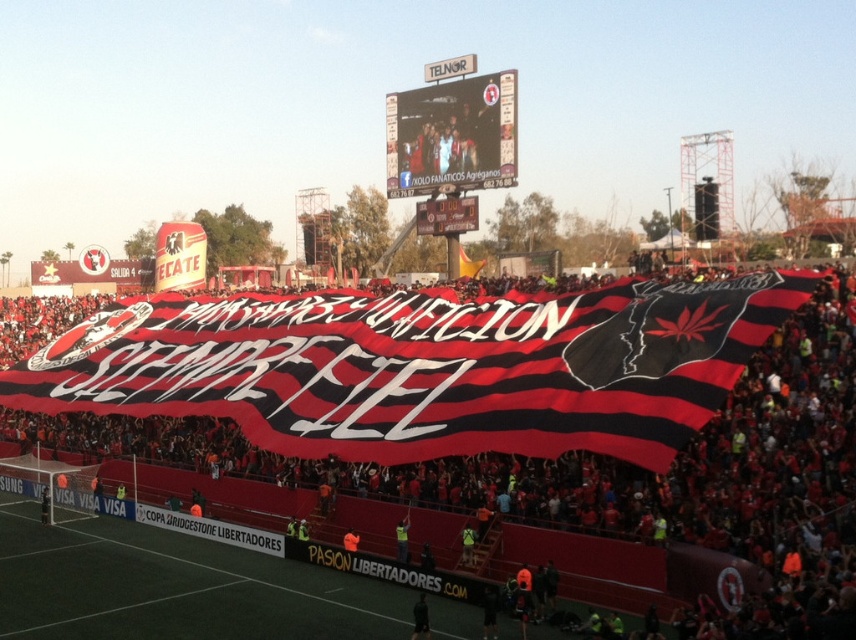
Question: Is black and red striped banner at center to the right of matte plastic scoreboard at upper center from the viewer's perspective?

Choices:
 (A) no
 (B) yes

Answer: (A)

Question: Which of the following is the closest to the observer?

Choices:
 (A) (569, 355)
 (B) (468, 180)

Answer: (A)

Question: Is black and red striped banner at center further to the viewer compared to matte plastic scoreboard at upper center?

Choices:
 (A) no
 (B) yes

Answer: (A)

Question: Does black and red striped banner at center come in front of matte plastic scoreboard at upper center?

Choices:
 (A) yes
 (B) no

Answer: (A)